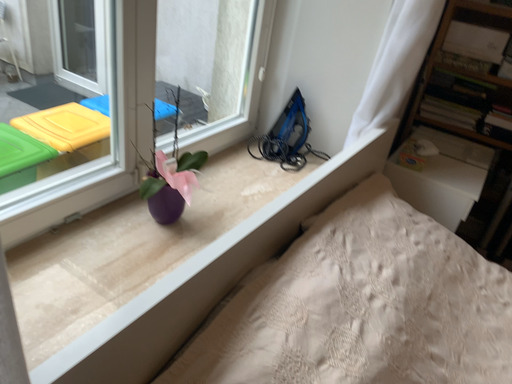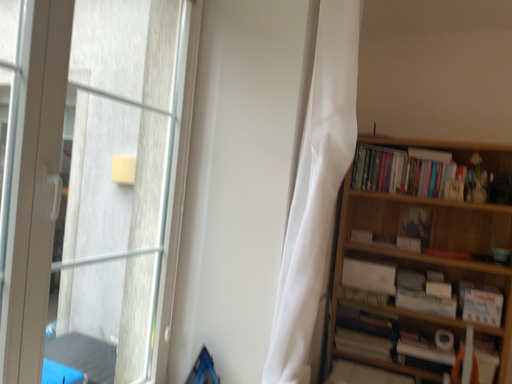
Question: Which way did the camera rotate in the video?

Choices:
 (A) rotated left
 (B) rotated right

Answer: (B)